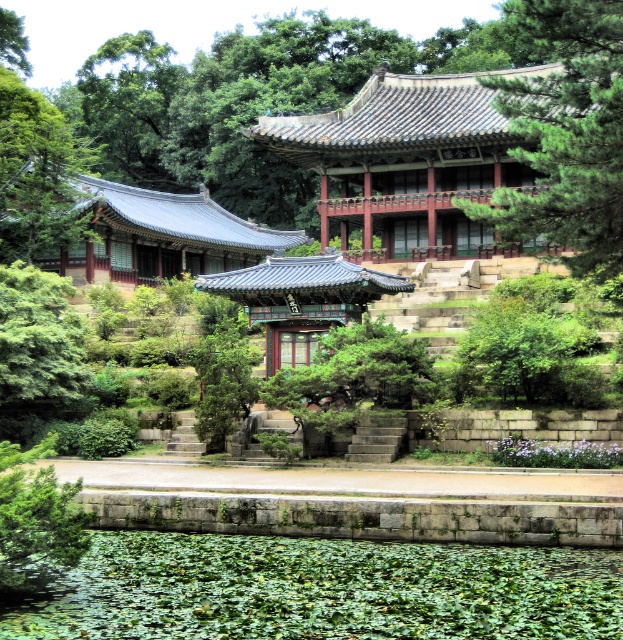
You are standing at the entrance of the palace complex and want to take a photo of the pavilion. There is a point at coordinates point (108, 632) that you need to consider. Is this point closer to you or farther away than 25 meters?

The distance of point (108, 632) from camera is 24.64 meters, so the point is closer than 25 meters.

You are an architect designing a garden layout and need to determine the placement of two trees based on their positions in the image. Which tree is closer to the viewer between the green textured pine tree at upper right and the green leafy tree at upper left?

The green textured pine tree at upper right is closer to the viewer than the green leafy tree at upper left.